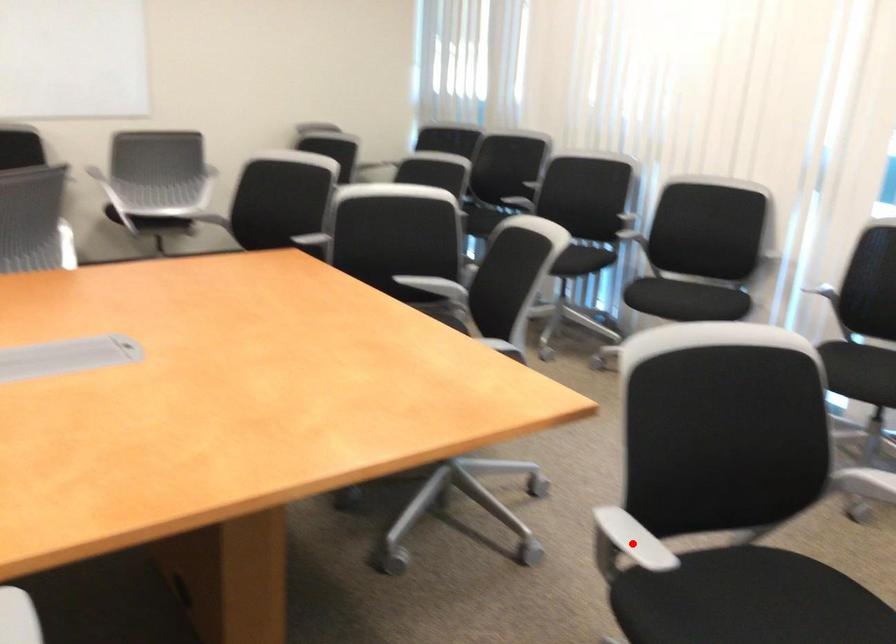
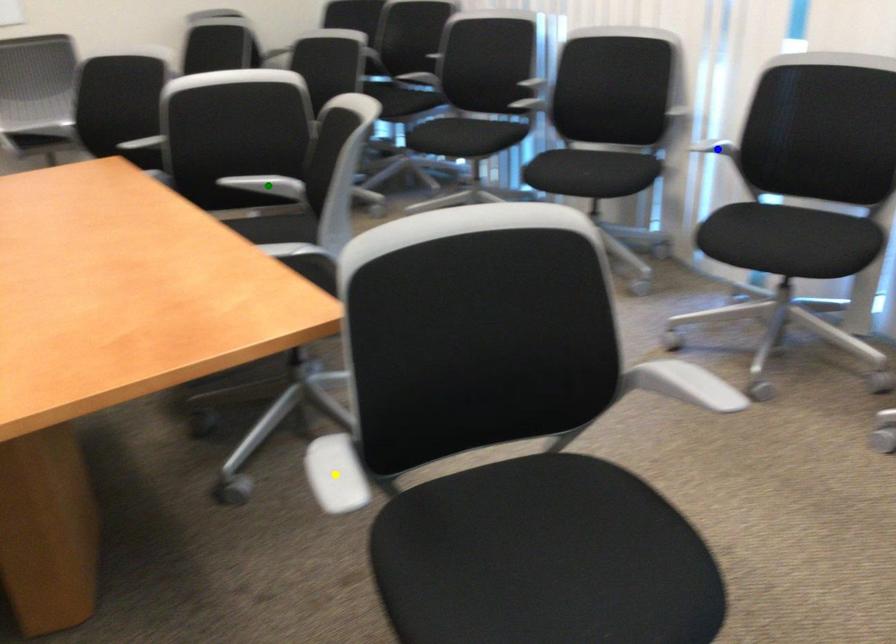
Question: I am providing you with two images of the same scene from different viewpoints. A red point is marked on the first image. You are given multiple points on the second image. Which point in image 2 represents the same 3d spot as the red point in image 1?

Choices:
 (A) yellow point
 (B) green point
 (C) blue point

Answer: (A)